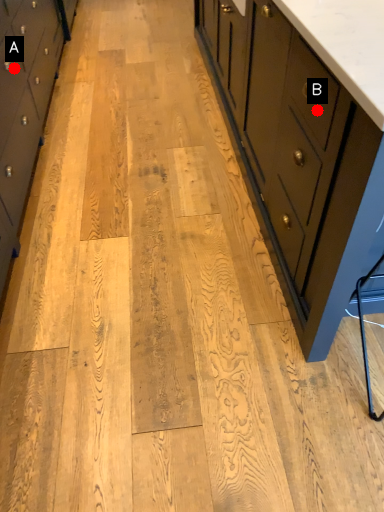
Question: Two points are circled on the image, labeled by A and B beside each circle. Which of the following is the closest to the observer?

Choices:
 (A) A is closer
 (B) B is closer

Answer: (B)